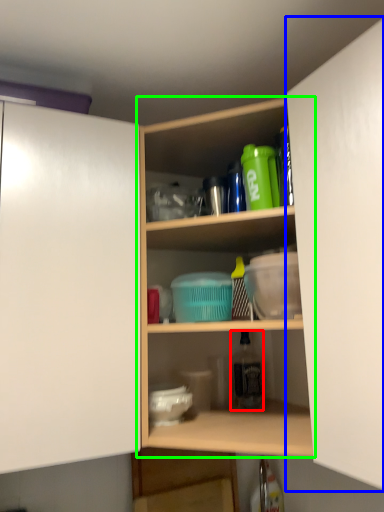
Question: Estimate the real-world distances between objects in this image. Which object is closer to bottle (highlighted by a red box), cabinetry (highlighted by a blue box) or shelf (highlighted by a green box)?

Choices:
 (A) cabinetry
 (B) shelf

Answer: (B)